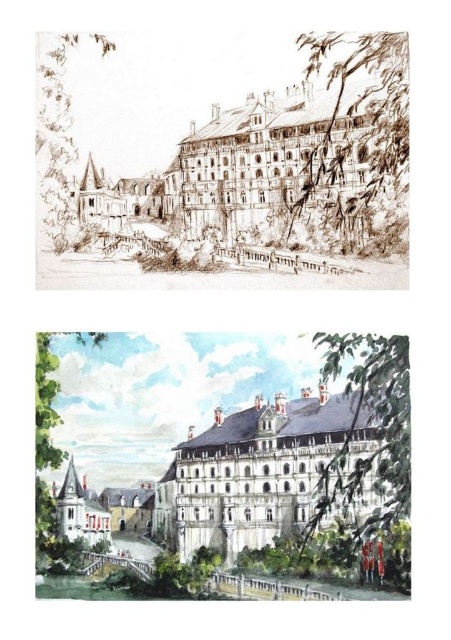
You are an architect reviewing two sketches of a building. The first sketch shows a white paper building at center, and the second shows a white stone palace at center. Based on the sketches, which one is bigger in size?

The white paper building at center is larger in size compared to the white stone palace at center.

You are an architect reviewing two sketches of a building. The first sketch is a white paper building at center and the second is a white stone palace at center. Which sketch is positioned higher in the image?

The white paper building at center is positioned higher because it is located above the white stone palace at center.

You are an architect reviewing two sketches of a building. The first sketch shows a white paper building at center, and the second shows a white stone palace at center. Both are displayed vertically. Which sketch do you think shows the building as being physically closer to you?

The white paper building at center is closer to the viewer than the white stone palace at center, so the first sketch shows the building as being physically closer to you.